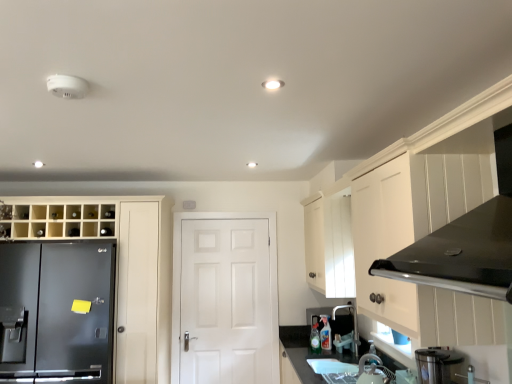
Identify the location of free point above white glossy sink at lower center (from a real-world perspective). (337, 364).